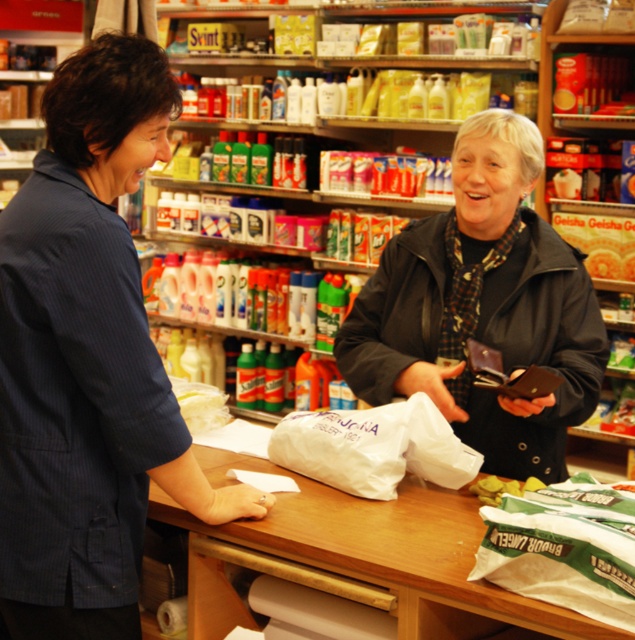
Consider the image. You are a cashier at the grocery store and need to hand a receipt to the customer. The receipt printer is located on the right side of the checkout counter. Which customer should you approach first, the one wearing the blue striped shirt at left or the dark blue jacket at center, to ensure you can reach them without moving too far from the printer?

You should approach the dark blue jacket at center first because they are closer to the receipt printer on the right side of the checkout counter compared to the blue striped shirt at left, who is farther away.

You are a customer at the checkout counter in the grocery store. You need to place your white matte grocery bag at center on the counter so it doesn not fall off. Where should you position it relative to the dark blue jacket at center?

The dark blue jacket at center is taller than the white matte grocery bag at center, so placing the white matte grocery bag at center behind or next to the dark blue jacket at center would help stabilize it and prevent it from falling off the counter.

You are standing at the checkout counter in a grocery store and see the dark blue jacket at center. If you want to hand them a bag of groceries, will you be able to reach them without moving closer?

The dark blue jacket at center and viewer are 6.48 feet apart. Since 6.48 feet is approximately 2 meters, which is beyond typical reaching distance, you would need to move closer to hand them the bag.